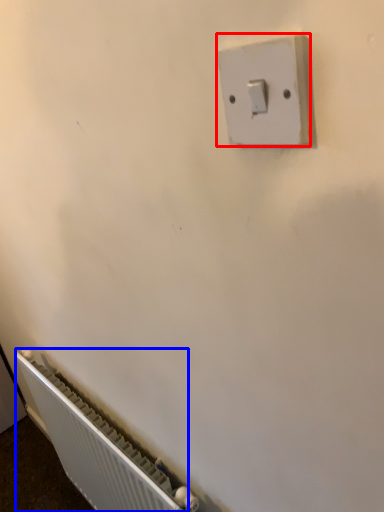
Question: Which of the following is the farthest to the observer, light switch (highlighted by a red box) or radiator (highlighted by a blue box)?

Choices:
 (A) light switch
 (B) radiator

Answer: (B)